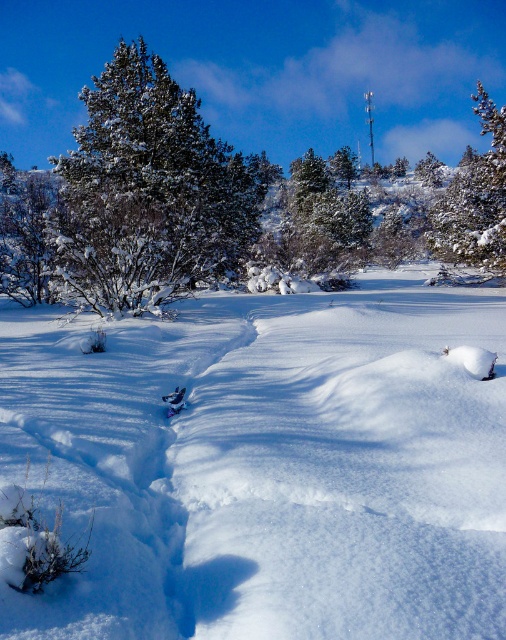
Is snow-covered pine tree at upper left further to camera compared to snow-covered pine tree at left?

No, snow-covered pine tree at upper left is closer to the viewer.

Between snow-covered pine tree at upper left and snow-covered pine tree at left, which one appears on the left side from the viewer's perspective?

snow-covered pine tree at left is more to the left.

What are the coordinates of `snow-covered pine tree at upper left` in the screenshot? It's located at (148, 189).

Locate an element on the screen. The image size is (506, 640). snow-covered pine tree at upper left is located at coordinates pyautogui.click(x=148, y=189).

The width and height of the screenshot is (506, 640). What do you see at coordinates (148, 189) in the screenshot? I see `snow-covered pine tree at upper left` at bounding box center [148, 189].

Is snow-covered pine tree at upper left below green textured pine at upper right?

Indeed, snow-covered pine tree at upper left is positioned under green textured pine at upper right.

Is point (180, 120) positioned after point (472, 170)?

No, (180, 120) is closer to viewer.

This screenshot has width=506, height=640. Find the location of `snow-covered pine tree at upper left`. snow-covered pine tree at upper left is located at coordinates (148, 189).

Is white fluffy snow at center taller than green textured pine at upper right?

No, white fluffy snow at center is not taller than green textured pine at upper right.

Who is lower down, white fluffy snow at center or green textured pine at upper right?

white fluffy snow at center is lower down.

Identify the location of white fluffy snow at center. The height and width of the screenshot is (640, 506). (268, 467).